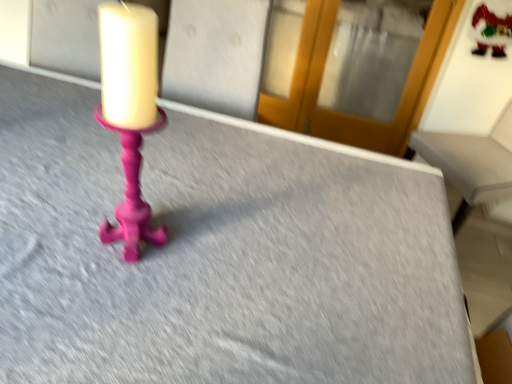
Question: From the image's perspective, does transparent glass door at upper center appear lower than frosted glass santa claus at upper right?

Choices:
 (A) yes
 (B) no

Answer: (B)

Question: Considering the relative sizes of transparent glass door at upper center and frosted glass santa claus at upper right in the image provided, is transparent glass door at upper center wider than frosted glass santa claus at upper right?

Choices:
 (A) yes
 (B) no

Answer: (A)

Question: Would you say transparent glass door at upper center is a long distance from frosted glass santa claus at upper right?

Choices:
 (A) yes
 (B) no

Answer: (B)

Question: Is transparent glass door at upper center turned away from frosted glass santa claus at upper right?

Choices:
 (A) yes
 (B) no

Answer: (B)

Question: From a real-world perspective, is transparent glass door at upper center beneath frosted glass santa claus at upper right?

Choices:
 (A) no
 (B) yes

Answer: (B)

Question: Is transparent glass door at upper center further to camera compared to frosted glass santa claus at upper right?

Choices:
 (A) no
 (B) yes

Answer: (B)

Question: Does frosted glass santa claus at upper right lie in front of transparent glass door at upper center?

Choices:
 (A) yes
 (B) no

Answer: (A)

Question: Is frosted glass santa claus at upper right beside transparent glass door at upper center?

Choices:
 (A) yes
 (B) no

Answer: (B)

Question: From a real-world perspective, is frosted glass santa claus at upper right located beneath transparent glass door at upper center?

Choices:
 (A) no
 (B) yes

Answer: (A)

Question: Is frosted glass santa claus at upper right further to the viewer compared to transparent glass door at upper center?

Choices:
 (A) no
 (B) yes

Answer: (A)

Question: Is frosted glass santa claus at upper right far away from transparent glass door at upper center?

Choices:
 (A) no
 (B) yes

Answer: (A)

Question: Is frosted glass santa claus at upper right to the right of transparent glass door at upper center from the viewer's perspective?

Choices:
 (A) yes
 (B) no

Answer: (A)

Question: Looking at their shapes, would you say frosted glass santa claus at upper right is wider or thinner than transparent glass door at upper center?

Choices:
 (A) thin
 (B) wide

Answer: (A)